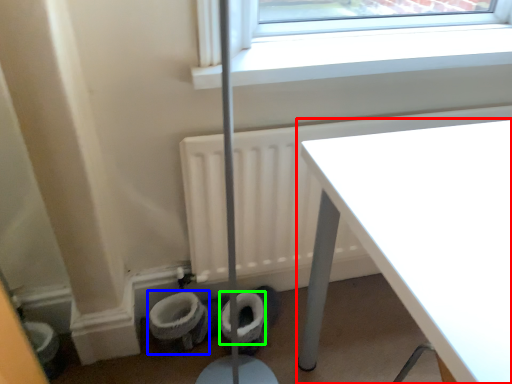
Question: Estimate the real-world distances between objects in this image. Which object is farther from table (highlighted by a red box), toilet bowl (highlighted by a blue box) or toilet paper (highlighted by a green box)?

Choices:
 (A) toilet bowl
 (B) toilet paper

Answer: (A)